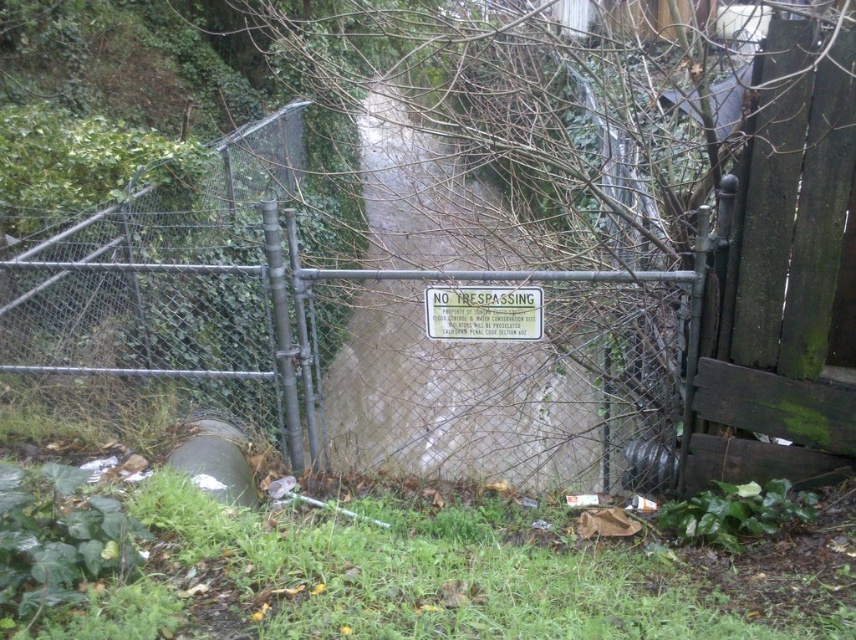
Can you confirm if metal chain-link fence at center is positioned above metallic silver sign at center?

Actually, metal chain-link fence at center is below metallic silver sign at center.

Can you confirm if metal chain-link fence at center is taller than metallic silver sign at center?

Correct, metal chain-link fence at center is much taller as metallic silver sign at center.

Where is `metal chain-link fence at center`? metal chain-link fence at center is located at coordinates (361, 321).

This screenshot has height=640, width=856. What are the coordinates of `metal chain-link fence at center` in the screenshot? It's located at (361, 321).

Can you confirm if green grass at lower center is thinner than metallic silver sign at center?

Incorrect, green grass at lower center's width is not less than metallic silver sign at center's.

Who is taller, green grass at lower center or metallic silver sign at center?

green grass at lower center

Locate an element on the screen. green grass at lower center is located at coordinates (406, 577).

You are a GUI agent. You are given a task and a screenshot of the screen. Output one action in this format:
    pyautogui.click(x=<x>, y=<y>)
    Task: Click on the green grass at lower center
    
    Given the screenshot: What is the action you would take?
    pyautogui.click(x=406, y=577)

Can you confirm if metal chain-link fence at center is positioned below green grass at lower center?

No, metal chain-link fence at center is not below green grass at lower center.

Is metal chain-link fence at center shorter than green grass at lower center?

Yes.

At what (x,y) coordinates should I click in order to perform the action: click on metal chain-link fence at center. Please return your answer as a coordinate pair (x, y). Image resolution: width=856 pixels, height=640 pixels. Looking at the image, I should click on (361, 321).

Find the location of a particular element. metal chain-link fence at center is located at coordinates (361, 321).